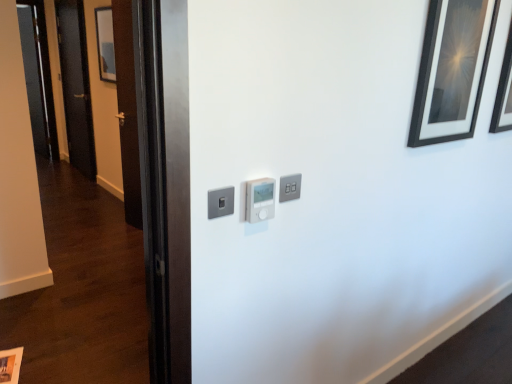
Question: Is white plastic thermostat at center, placed as the second light switch when sorted from right to left, located outside transparent glass door at left?

Choices:
 (A) yes
 (B) no

Answer: (A)

Question: Is white plastic thermostat at center, the 2th light switch from the left, to the left of transparent glass door at left from the viewer's perspective?

Choices:
 (A) no
 (B) yes

Answer: (A)

Question: Does white plastic thermostat at center, placed as the second light switch when sorted from right to left, have a lesser height compared to transparent glass door at left?

Choices:
 (A) yes
 (B) no

Answer: (A)

Question: Does white plastic thermostat at center, the 2th light switch from the left, have a lesser width compared to transparent glass door at left?

Choices:
 (A) yes
 (B) no

Answer: (B)

Question: Is the depth of white plastic thermostat at center, the 2th light switch from the left, greater than that of transparent glass door at left?

Choices:
 (A) no
 (B) yes

Answer: (A)

Question: From the image's perspective, is black glossy picture frame at upper right, which is the second picture frame from top to bottom, positioned above or below satin silver switch at center, the third light switch when ordered from right to left?

Choices:
 (A) above
 (B) below

Answer: (A)

Question: Looking at their shapes, would you say black glossy picture frame at upper right, marked as the third picture frame in a back-to-front arrangement, is wider or thinner than satin silver switch at center, which is the 1th light switch in left-to-right order?

Choices:
 (A) wide
 (B) thin

Answer: (A)

Question: Considering the positions of point (502, 130) and point (229, 195), is point (502, 130) closer or farther from the camera than point (229, 195)?

Choices:
 (A) farther
 (B) closer

Answer: (A)

Question: From their relative heights in the image, would you say black glossy picture frame at upper right, acting as the 2th picture frame starting from the front, is taller or shorter than satin silver switch at center, which is the 1th light switch in left-to-right order?

Choices:
 (A) tall
 (B) short

Answer: (A)

Question: Does point (451, 134) appear closer or farther from the camera than point (267, 195)?

Choices:
 (A) closer
 (B) farther

Answer: (B)

Question: Would you say black matte picture frame at upper right, positioned as the 1th picture frame in front-to-back order, is inside or outside white plastic thermostat at center, the 2th light switch from the left?

Choices:
 (A) outside
 (B) inside

Answer: (A)

Question: In the image, is black matte picture frame at upper right, positioned as the 1th picture frame in front-to-back order, positioned in front of or behind white plastic thermostat at center, the 2th light switch from the left?

Choices:
 (A) behind
 (B) front

Answer: (A)

Question: Is black matte picture frame at upper right, placed as the 4th picture frame when sorted from back to front, taller or shorter than white plastic thermostat at center, the 2th light switch from the left?

Choices:
 (A) short
 (B) tall

Answer: (B)

Question: Looking at their shapes, would you say satin silver light switch at upper center, the first light switch positioned from the right, is wider or thinner than black glossy picture frame at upper right, arranged as the first picture frame when viewed from the right?

Choices:
 (A) wide
 (B) thin

Answer: (B)

Question: From a real-world perspective, is satin silver light switch at upper center, the first light switch positioned from the right, above or below black glossy picture frame at upper right, the fourth picture frame from the left?

Choices:
 (A) above
 (B) below

Answer: (B)